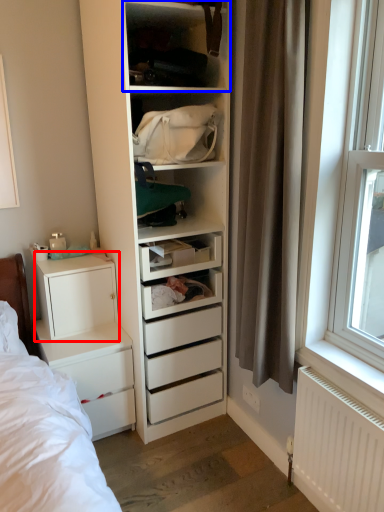
Question: Which object is closer to the camera taking this photo, cabinetry (highlighted by a red box) or shelf (highlighted by a blue box)?

Choices:
 (A) cabinetry
 (B) shelf

Answer: (B)